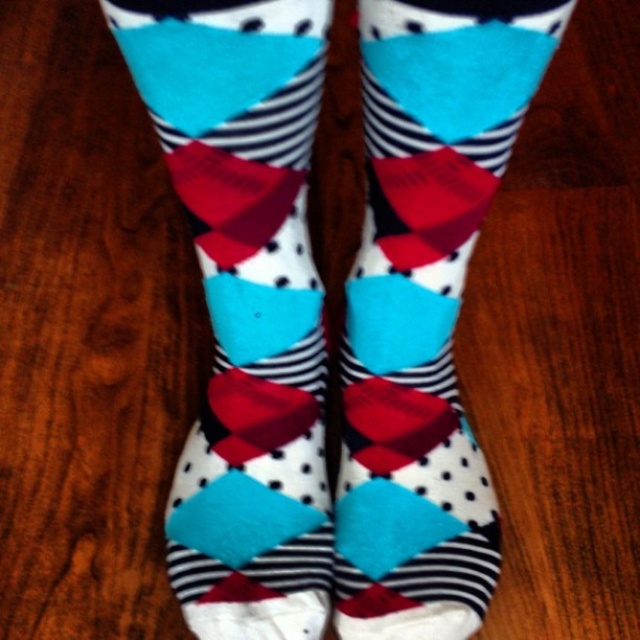
Question: Which point is farther from the camera taking this photo?

Choices:
 (A) (236, 205)
 (B) (424, 593)

Answer: (B)

Question: Can you confirm if matte cotton socks at center is wider than cotton socks at center?

Choices:
 (A) yes
 (B) no

Answer: (A)

Question: Does matte cotton socks at center have a greater width compared to cotton socks at center?

Choices:
 (A) yes
 (B) no

Answer: (A)

Question: Can you confirm if matte cotton socks at center is positioned to the left of cotton socks at center?

Choices:
 (A) no
 (B) yes

Answer: (B)

Question: Which point appears farthest from the camera in this image?

Choices:
 (A) (476, 564)
 (B) (140, 0)

Answer: (A)